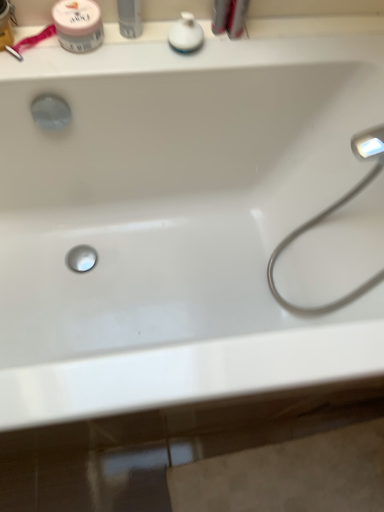
Question: Does pink matte jar at upper left have a lesser width compared to satin nickel faucet at right?

Choices:
 (A) yes
 (B) no

Answer: (A)

Question: Is pink matte jar at upper left aimed at satin nickel faucet at right?

Choices:
 (A) no
 (B) yes

Answer: (A)

Question: Is pink matte jar at upper left positioned before satin nickel faucet at right?

Choices:
 (A) no
 (B) yes

Answer: (A)

Question: From a real-world perspective, is pink matte jar at upper left physically above satin nickel faucet at right?

Choices:
 (A) yes
 (B) no

Answer: (A)

Question: From the image's perspective, is pink matte jar at upper left on top of satin nickel faucet at right?

Choices:
 (A) yes
 (B) no

Answer: (A)

Question: From their relative heights in the image, would you say white glossy soap dispenser at upper center, which is counted as the first toiletry, starting from the right, is taller or shorter than white glossy spray can at upper center, which is the second toiletry from right to left?

Choices:
 (A) tall
 (B) short

Answer: (B)

Question: Is white glossy soap dispenser at upper center, which is counted as the first toiletry, starting from the right, in front of or behind white glossy spray can at upper center, which is the second toiletry from right to left, in the image?

Choices:
 (A) front
 (B) behind

Answer: (B)

Question: Looking at their shapes, would you say white glossy soap dispenser at upper center, which is counted as the 2th toiletry, starting from the left, is wider or thinner than white glossy spray can at upper center, which is the 1th toiletry in left-to-right order?

Choices:
 (A) wide
 (B) thin

Answer: (A)

Question: Is point (192, 32) positioned closer to the camera than point (137, 32)?

Choices:
 (A) farther
 (B) closer

Answer: (B)

Question: Visually, is white glossy spray can at upper center, which is the second toiletry from right to left, positioned to the left or to the right of pink matte jar at upper left?

Choices:
 (A) right
 (B) left

Answer: (A)

Question: Is white glossy spray can at upper center, which is the 1th toiletry in left-to-right order, in front of or behind pink matte jar at upper left in the image?

Choices:
 (A) behind
 (B) front

Answer: (B)

Question: In terms of width, does white glossy spray can at upper center, which is the second toiletry from right to left, look wider or thinner when compared to pink matte jar at upper left?

Choices:
 (A) wide
 (B) thin

Answer: (B)

Question: From a real-world perspective, relative to pink matte jar at upper left, is white glossy spray can at upper center, which is the second toiletry from right to left, vertically above or below?

Choices:
 (A) below
 (B) above

Answer: (B)

Question: Is white glossy spray can at upper center, which is the 1th toiletry in left-to-right order, inside or outside of satin nickel faucet at right?

Choices:
 (A) inside
 (B) outside

Answer: (B)

Question: From a real-world perspective, is white glossy spray can at upper center, which is the second toiletry from right to left, above or below satin nickel faucet at right?

Choices:
 (A) below
 (B) above

Answer: (B)